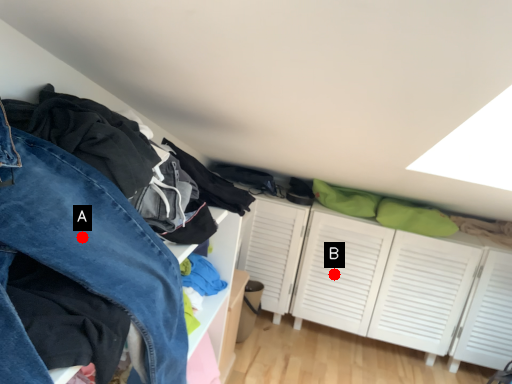
Question: Two points are circled on the image, labeled by A and B beside each circle. Among these points, which one is nearest to the camera?

Choices:
 (A) A is closer
 (B) B is closer

Answer: (A)